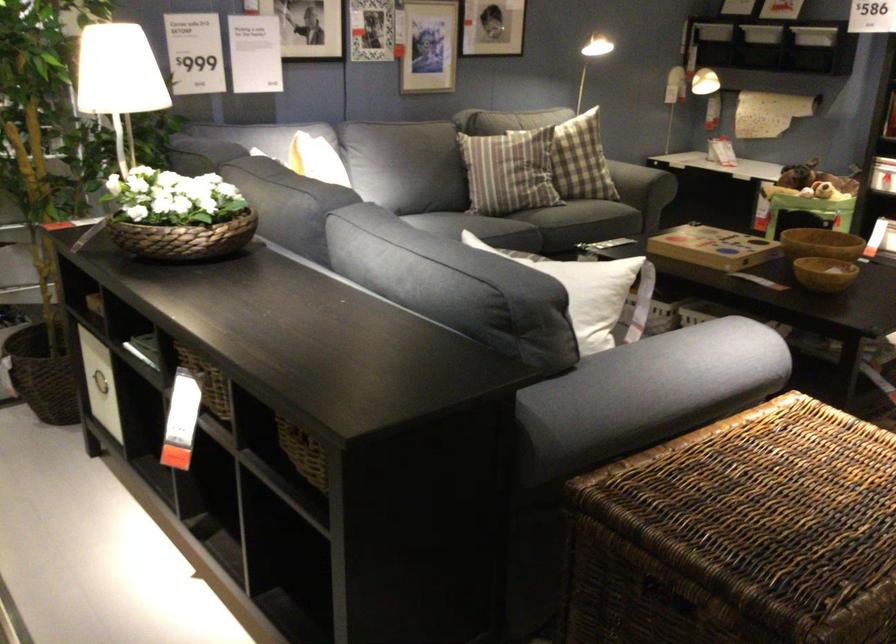
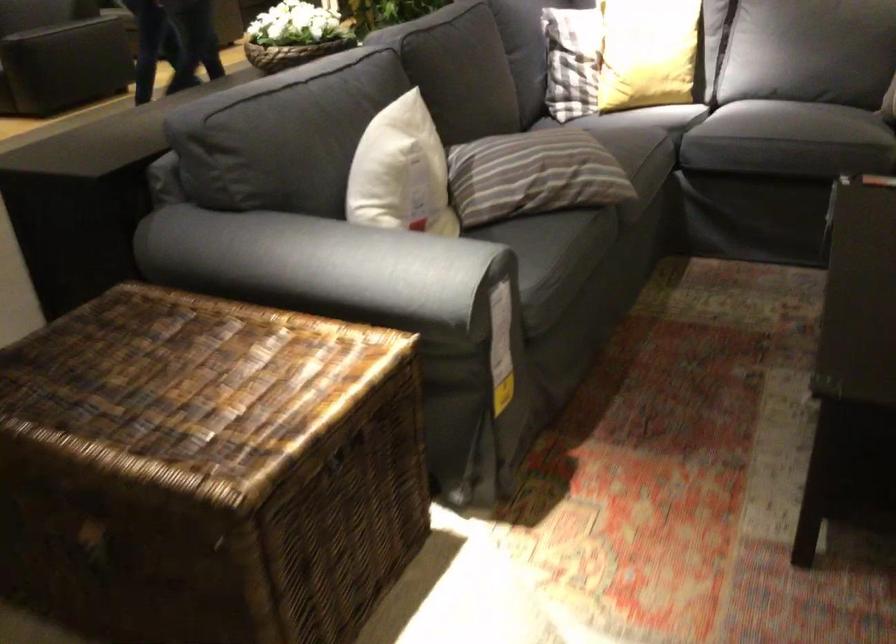
Locate, in the second image, the point that corresponds to (x=237, y=228) in the first image.

(291, 53)